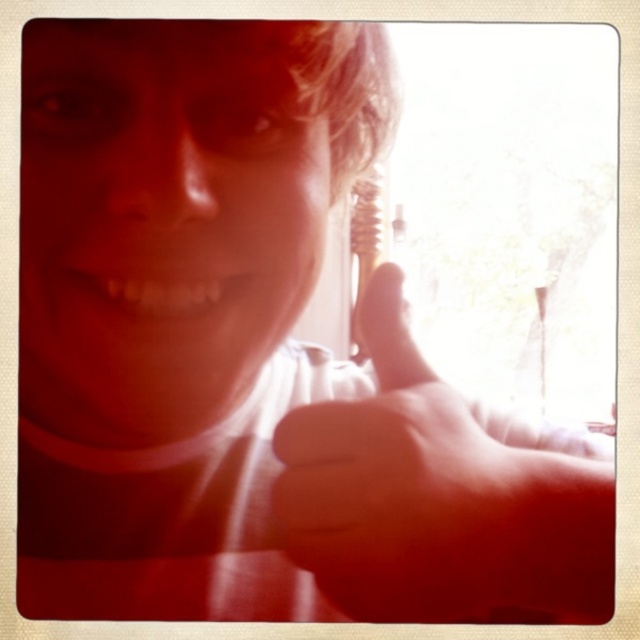
Between smooth skin hand at center and matte white teeth at center, which one appears on the right side from the viewer's perspective?

smooth skin hand at center

Is smooth skin hand at center further to camera compared to matte white teeth at center?

That is False.

Between point (467, 564) and point (157, 305), which one is positioned in front?

Point (467, 564) is in front.

Image resolution: width=640 pixels, height=640 pixels. In order to click on smooth skin hand at center in this screenshot , I will do `click(436, 499)`.